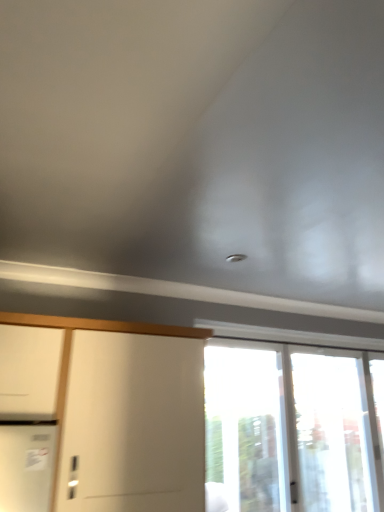
This screenshot has width=384, height=512. What do you see at coordinates (293, 428) in the screenshot?
I see `transparent glass window at right` at bounding box center [293, 428].

What is the approximate height of transparent glass window at right?

transparent glass window at right is 1.24 meters in height.

Image resolution: width=384 pixels, height=512 pixels. I want to click on transparent glass window at right, so click(293, 428).

Identify the location of transparent glass window at right. Image resolution: width=384 pixels, height=512 pixels. (293, 428).